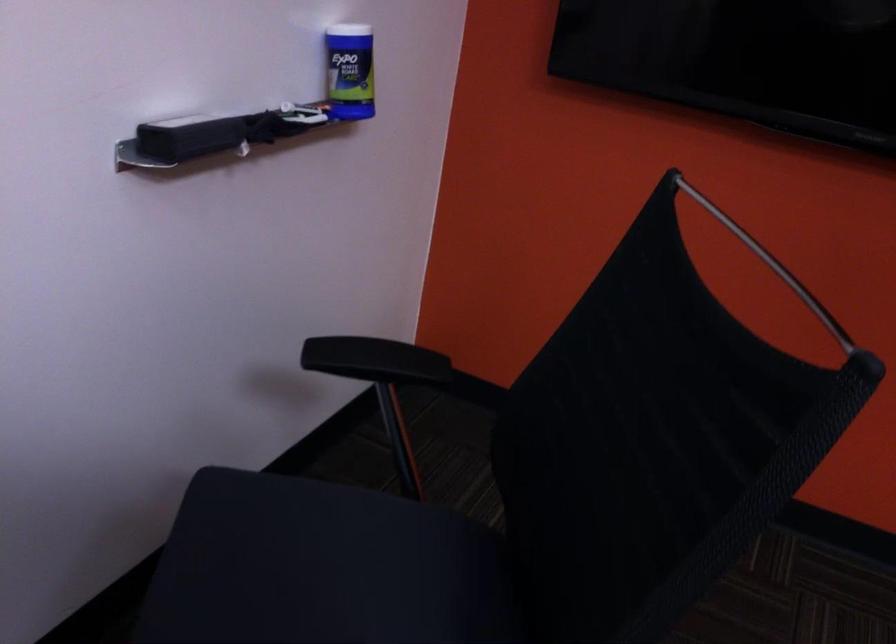
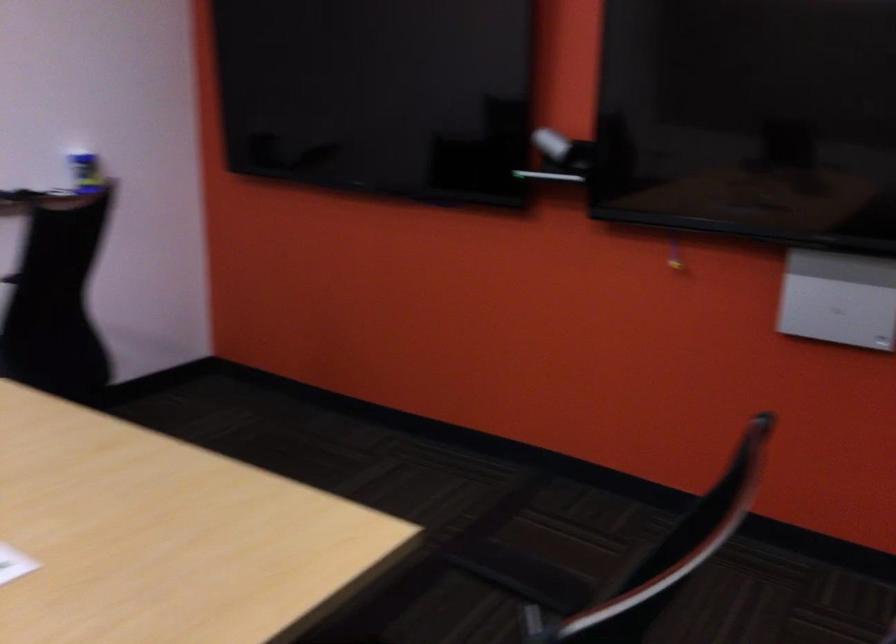
The point at (x=349, y=109) is marked in the first image. Where is the corresponding point in the second image?

(85, 172)